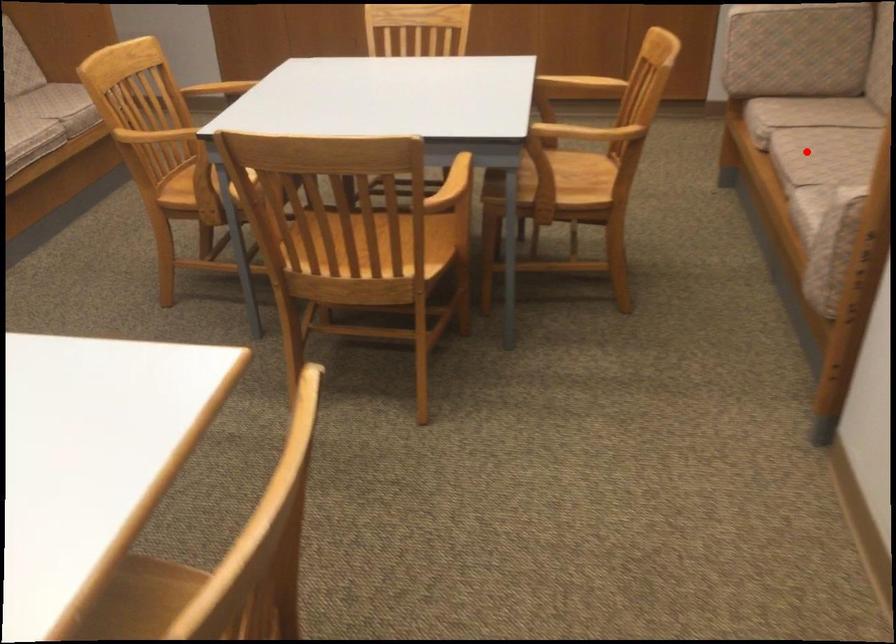
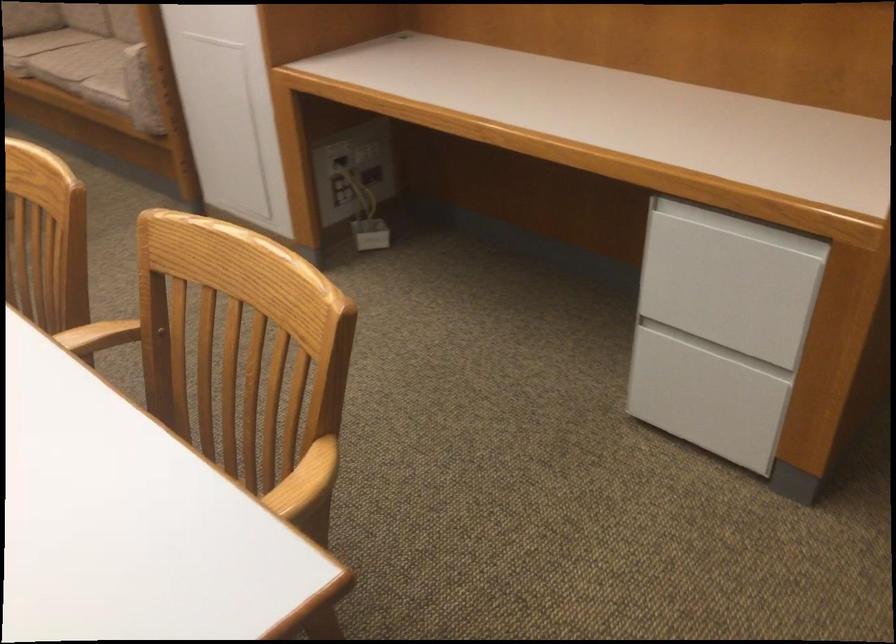
Question: I am providing you with two images of the same scene from different viewpoints. A red point is marked on the first image. Can you still see the location of the red point in image 2?

Choices:
 (A) Yes
 (B) No

Answer: (A)